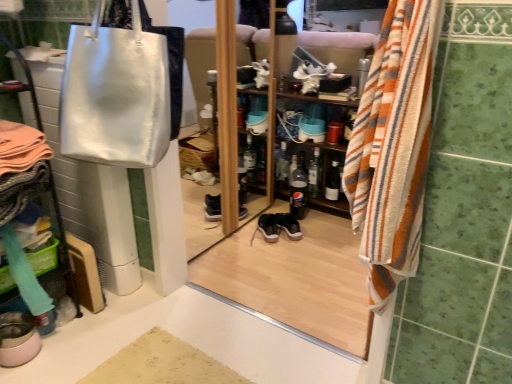
The image size is (512, 384). I want to click on vacant area to the left of beige textured bath mat at lower center, so click(x=76, y=351).